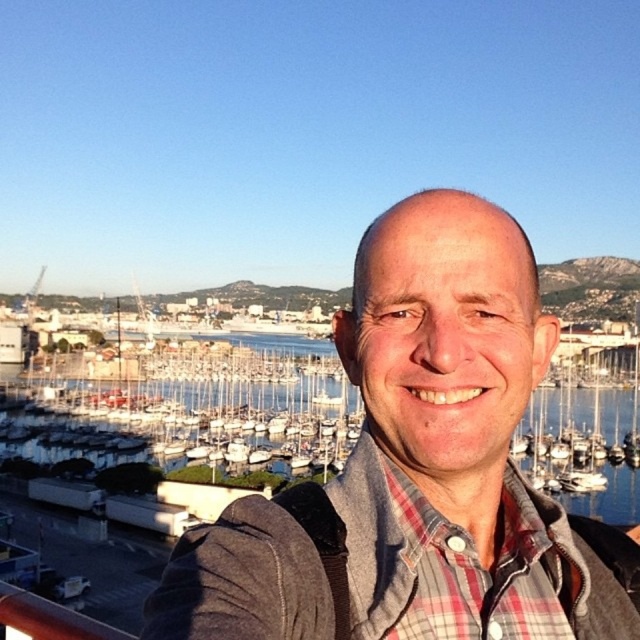
Question: Which point appears closest to the camera in this image?

Choices:
 (A) (492, 490)
 (B) (320, 452)

Answer: (A)

Question: Which of the following is the farthest from the observer?

Choices:
 (A) gray fabric jacket at center
 (B) blue water at center

Answer: (B)

Question: Which point is farther from the camera taking this photo?

Choices:
 (A) click(x=580, y=480)
 (B) click(x=461, y=612)

Answer: (A)

Question: Is gray fabric jacket at center bigger than blue water at center?

Choices:
 (A) yes
 (B) no

Answer: (B)

Question: Is gray fabric jacket at center bigger than blue water at center?

Choices:
 (A) yes
 (B) no

Answer: (B)

Question: Can you confirm if gray fabric jacket at center is thinner than blue water at center?

Choices:
 (A) no
 (B) yes

Answer: (B)